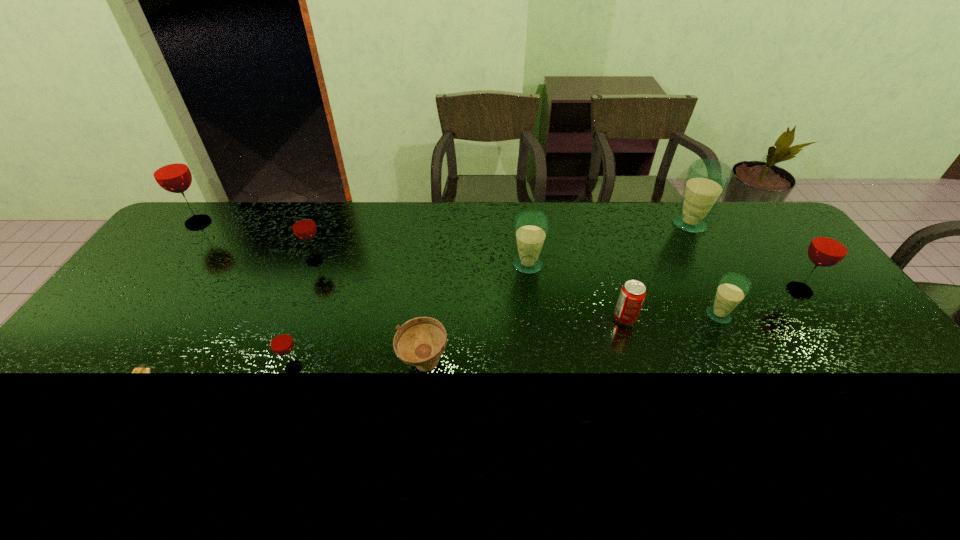
Locate an element on the screen. the smallest red glass is located at coordinates (281, 343).

The height and width of the screenshot is (540, 960). I want to click on the nearest red glass, so click(x=281, y=343).

The height and width of the screenshot is (540, 960). What are the coordinates of `soda` in the screenshot? It's located at (632, 295).

Where is `the fifth object from left to right`? The width and height of the screenshot is (960, 540). the fifth object from left to right is located at coordinates (420, 342).

The height and width of the screenshot is (540, 960). I want to click on the shortest object, so click(x=141, y=368).

The width and height of the screenshot is (960, 540). I want to click on pistol, so click(141, 368).

Locate an element on the screen. free space located 0.190m on the front of the leftmost red glass is located at coordinates (163, 268).

Where is `free space located 0.060m on the front of the rightmost object`? This screenshot has height=540, width=960. free space located 0.060m on the front of the rightmost object is located at coordinates (818, 316).

Identify the location of free spot located 0.090m on the right of the biggest blue glass. (733, 224).

Locate an element on the screen. The image size is (960, 540). free region located 0.190m on the right of the second smallest red glass is located at coordinates (384, 260).